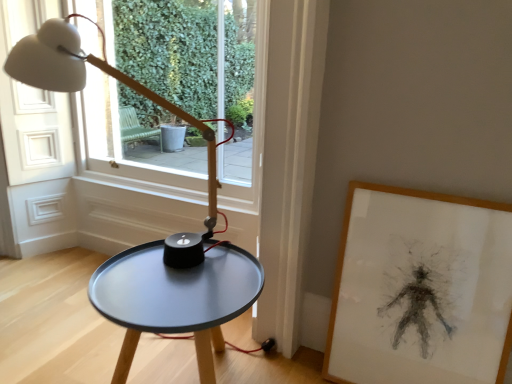
Locate an element on the screen. This screenshot has height=384, width=512. free point above matte black table at center (from a real-world perspective) is located at coordinates (190, 284).